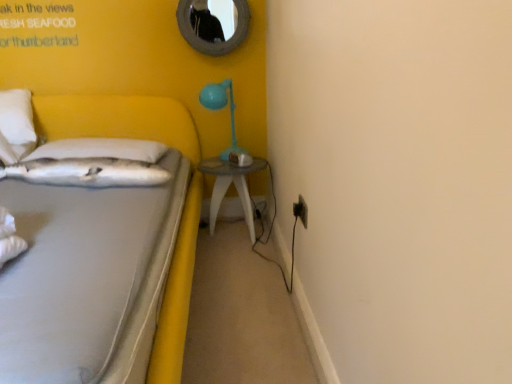
Question: Looking at the image, does white fabric bed at left seem bigger or smaller compared to white soft pillow at left, the second pillow positioned from the front?

Choices:
 (A) small
 (B) big

Answer: (B)

Question: Is white fabric bed at left taller or shorter than white soft pillow at left, which ranks as the first pillow in back-to-front order?

Choices:
 (A) tall
 (B) short

Answer: (A)

Question: Which object is positioned closest to the white soft pillow at left, which is counted as the second pillow, starting from the back?

Choices:
 (A) black plastic electric outlet at lower right
 (B) white soft pillow at left, the second pillow positioned from the front
 (C) matte blue plastic table lamp at upper right
 (D) rounded silver mirror at upper center
 (E) white fabric bed at left

Answer: (B)

Question: Which is farther from the white fabric bed at left?

Choices:
 (A) black plastic electric outlet at lower right
 (B) matte blue plastic table lamp at upper right
 (C) clear glass table at center
 (D) white soft pillow at left, which is counted as the second pillow, starting from the back
 (E) rounded silver mirror at upper center

Answer: (A)